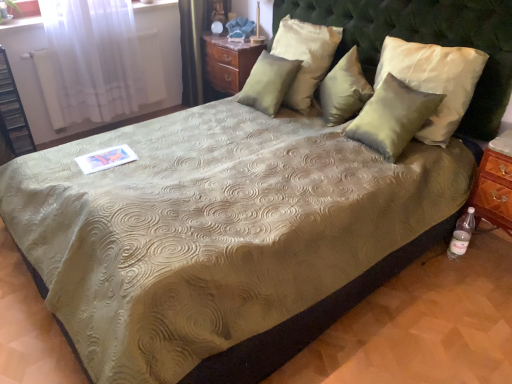
Describe the element at coordinates (462, 234) in the screenshot. I see `clear plastic bottle at lower right` at that location.

Identify the location of clear plastic bottle at lower right. (462, 234).

Measure the distance between point (257, 99) and camera.

Point (257, 99) and camera are 9.64 feet apart from each other.

This screenshot has width=512, height=384. What do you see at coordinates (95, 58) in the screenshot?
I see `white sheer curtain at upper left` at bounding box center [95, 58].

This screenshot has width=512, height=384. What are the coordinates of `clear plastic bottle at lower right` in the screenshot? It's located at (462, 234).

From the image's perspective, is white sheer curtain at upper left located above or below wooden nightstand at upper center?

Based on their image positions, white sheer curtain at upper left is located beneath wooden nightstand at upper center.

Is white sheer curtain at upper left positioned beyond the bounds of wooden nightstand at upper center?

Indeed, white sheer curtain at upper left is completely outside wooden nightstand at upper center.

From a real-world perspective, relative to wooden nightstand at upper center, is white sheer curtain at upper left vertically above or below?

white sheer curtain at upper left is above wooden nightstand at upper center.

Can you confirm if white sheer curtain at upper left is taller than wooden nightstand at upper center?

Indeed, white sheer curtain at upper left has a greater height compared to wooden nightstand at upper center.

Is wooden nightstand at upper center wider than clear plastic bottle at lower right?

Indeed, wooden nightstand at upper center has a greater width compared to clear plastic bottle at lower right.

Do you think wooden nightstand at upper center is within clear plastic bottle at lower right, or outside of it?

wooden nightstand at upper center lies outside clear plastic bottle at lower right.

Does wooden nightstand at upper center appear on the right side of clear plastic bottle at lower right?

In fact, wooden nightstand at upper center is to the left of clear plastic bottle at lower right.

What's the angular difference between wooden nightstand at upper center and clear plastic bottle at lower right's facing directions?

The angle between the facing direction of wooden nightstand at upper center and the facing direction of clear plastic bottle at lower right is 2.79 degrees.

Which is less distant, (272, 77) or (210, 71)?

The point (272, 77) is closer to the camera.

Based on the photo, from the image's perspective, is satin green pillow at upper center, the 4th pillow from the right, located above wooden nightstand at upper center?

No.

Can we say satin green pillow at upper center, which is the first pillow from left to right, lies outside wooden nightstand at upper center?

satin green pillow at upper center, which is the first pillow from left to right, lies outside wooden nightstand at upper center's area.

Is satin green pillow at upper center, which is the first pillow from left to right, thinner than wooden nightstand at upper center?

Yes, satin green pillow at upper center, which is the first pillow from left to right, is thinner than wooden nightstand at upper center.

From a real-world perspective, who is located higher, wooden nightstand at upper center or white sheer curtain at upper left?

white sheer curtain at upper left.

Considering the relative sizes of wooden nightstand at upper center and white sheer curtain at upper left in the image provided, is wooden nightstand at upper center wider than white sheer curtain at upper left?

No, wooden nightstand at upper center is not wider than white sheer curtain at upper left.

Can we say wooden nightstand at upper center lies outside white sheer curtain at upper left?

Indeed, wooden nightstand at upper center is completely outside white sheer curtain at upper left.

Is green tufted headboard at upper center positioned with its back to black plastic shelf at left?

No.

Between green tufted headboard at upper center and black plastic shelf at left, which one has less height?

green tufted headboard at upper center is shorter.

Consider the image. Is green tufted headboard at upper center directly adjacent to black plastic shelf at left?

green tufted headboard at upper center is not next to black plastic shelf at left, and they're not touching.

Find the location of `dresser behind the green tufted headboard at upper center`. dresser behind the green tufted headboard at upper center is located at coordinates (13, 112).

Does point (52, 9) come closer to viewer compared to point (362, 124)?

No, it is behind (362, 124).

Looking at this image, considering the relative sizes of white sheer curtain at upper left and satin green pillow at upper right, which ranks as the first pillow in right-to-left order, in the image provided, is white sheer curtain at upper left bigger than satin green pillow at upper right, which ranks as the first pillow in right-to-left order,?

Yes, white sheer curtain at upper left is bigger than satin green pillow at upper right, which ranks as the first pillow in right-to-left order.

Considering the relative positions of white sheer curtain at upper left and satin green pillow at upper right, which is counted as the 4th pillow, starting from the left, in the image provided, is white sheer curtain at upper left to the left or to the right of satin green pillow at upper right, which is counted as the 4th pillow, starting from the left,?

From the image, it's evident that white sheer curtain at upper left is to the left of satin green pillow at upper right, which is counted as the 4th pillow, starting from the left.

From the image's perspective, between white sheer curtain at upper left and satin green pillow at upper right, which ranks as the first pillow in right-to-left order, who is located below?

satin green pillow at upper right, which ranks as the first pillow in right-to-left order, is shown below in the image.

From a real-world perspective, which is physically below, satin green pillow at upper right, which is counted as the 4th pillow, starting from the left, or satin green pillow at center, positioned as the third pillow in left-to-right order?

In real-world perspective, satin green pillow at center, positioned as the third pillow in left-to-right order, is lower.

The width and height of the screenshot is (512, 384). Identify the location of pillow below the satin green pillow at center, positioned as the third pillow in left-to-right order (from the image's perspective). (392, 117).

Can you confirm if satin green pillow at upper right, which is counted as the 4th pillow, starting from the left, is positioned to the right of satin green pillow at center, positioned as the third pillow in left-to-right order?

Correct, you'll find satin green pillow at upper right, which is counted as the 4th pillow, starting from the left, to the right of satin green pillow at center, positioned as the third pillow in left-to-right order.

Considering the positions of objects satin green pillow at upper right, which is counted as the 4th pillow, starting from the left, and satin green pillow at center, arranged as the second pillow when viewed from the right, in the image provided, who is in front, satin green pillow at upper right, which is counted as the 4th pillow, starting from the left, or satin green pillow at center, arranged as the second pillow when viewed from the right,?

Positioned in front is satin green pillow at upper right, which is counted as the 4th pillow, starting from the left.

Locate an element on the screen. This screenshot has height=384, width=512. nightstand above the white sheer curtain at upper left (from the image's perspective) is located at coordinates (229, 62).

I want to click on nightstand that appears on the left of clear plastic bottle at lower right, so click(229, 62).

Based on their spatial positions, is satin green pillow at upper right, which ranks as the first pillow in right-to-left order, or satin white pillow at upper center, placed as the 3th pillow when sorted from right to left, closer to satin green pillow at upper center, which is the first pillow from left to right?

satin white pillow at upper center, placed as the 3th pillow when sorted from right to left, lies closer to satin green pillow at upper center, which is the first pillow from left to right, than the other object.

When comparing their distances from green tufted headboard at upper center, does satin green pillow at center, arranged as the second pillow when viewed from the right, or satin white pillow at upper center, which is the 2th pillow in left-to-right order, seem closer?

satin green pillow at center, arranged as the second pillow when viewed from the right, is closer to green tufted headboard at upper center.

From the image, which object appears to be farther from satin green pillow at center, arranged as the second pillow when viewed from the right, clear plastic bottle at lower right or satin green pillow at upper center, the 4th pillow from the right?

clear plastic bottle at lower right lies further to satin green pillow at center, arranged as the second pillow when viewed from the right, than the other object.

When comparing their distances from satin green pillow at upper center, the 4th pillow from the right, does satin green pillow at center, positioned as the third pillow in left-to-right order, or white sheer curtain at upper left seem closer?

Among the two, satin green pillow at center, positioned as the third pillow in left-to-right order, is located nearer to satin green pillow at upper center, the 4th pillow from the right.

Based on their spatial positions, is black plastic shelf at left or satin green pillow at upper right, which ranks as the first pillow in right-to-left order, further from satin white pillow at upper center, which is the 2th pillow in left-to-right order?

black plastic shelf at left lies further to satin white pillow at upper center, which is the 2th pillow in left-to-right order, than the other object.

Based on their spatial positions, is green tufted headboard at upper center or satin green pillow at center, positioned as the third pillow in left-to-right order, further from clear plastic bottle at lower right?

satin green pillow at center, positioned as the third pillow in left-to-right order.

Looking at the image, which one is located closer to satin white pillow at upper center, placed as the 3th pillow when sorted from right to left, green tufted headboard at upper center or satin green pillow at center, positioned as the third pillow in left-to-right order?

satin green pillow at center, positioned as the third pillow in left-to-right order, lies closer to satin white pillow at upper center, placed as the 3th pillow when sorted from right to left, than the other object.

Considering their positions, is wooden nightstand at upper center positioned further to satin green pillow at center, arranged as the second pillow when viewed from the right, than black plastic shelf at left?

black plastic shelf at left.

Identify the location of pillow between satin green pillow at upper center, the 4th pillow from the right, and satin green pillow at center, positioned as the third pillow in left-to-right order, in the horizontal direction. (305, 56).

The height and width of the screenshot is (384, 512). What are the coordinates of `pillow positioned between satin green pillow at upper right, which is counted as the 4th pillow, starting from the left, and satin white pillow at upper center, which is the 2th pillow in left-to-right order, from near to far` in the screenshot? It's located at (344, 90).

Find the location of a particular element. The image size is (512, 384). nightstand between white sheer curtain at upper left and satin green pillow at upper right, which is counted as the 4th pillow, starting from the left, in the horizontal direction is located at coordinates (229, 62).

The height and width of the screenshot is (384, 512). I want to click on pillow between black plastic shelf at left and satin white pillow at upper center, placed as the 3th pillow when sorted from right to left, in the horizontal direction, so click(268, 83).